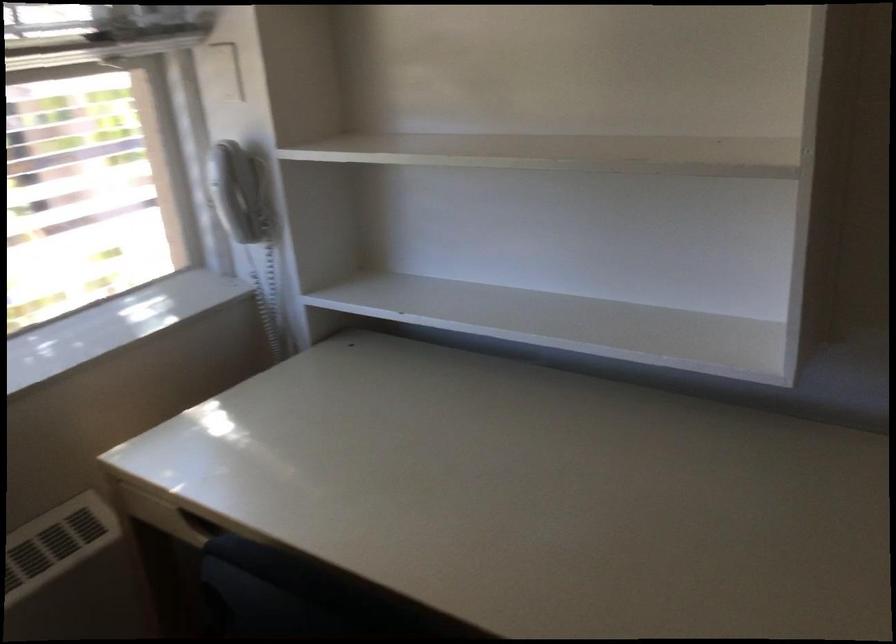
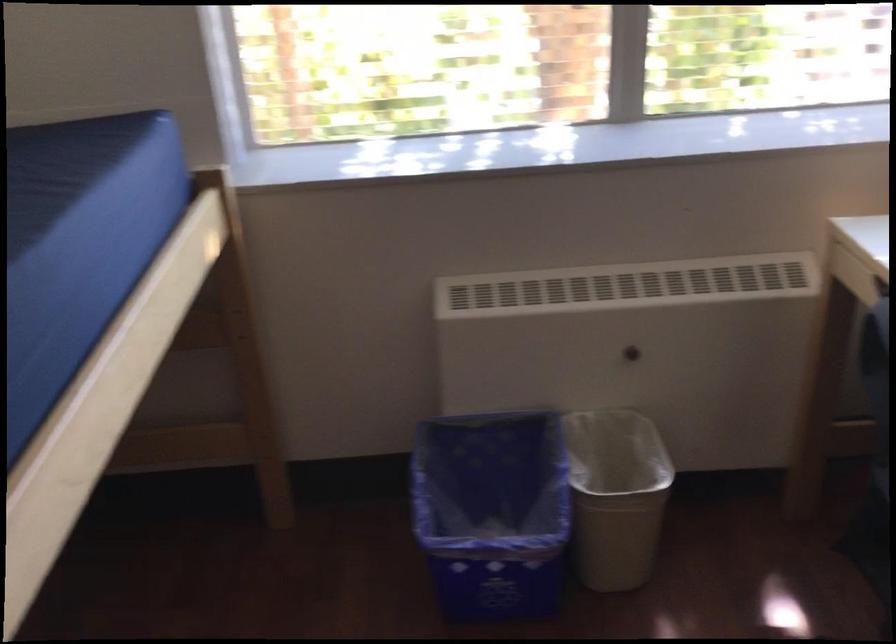
How did the camera likely rotate?

The rotation direction of the camera is left-down.